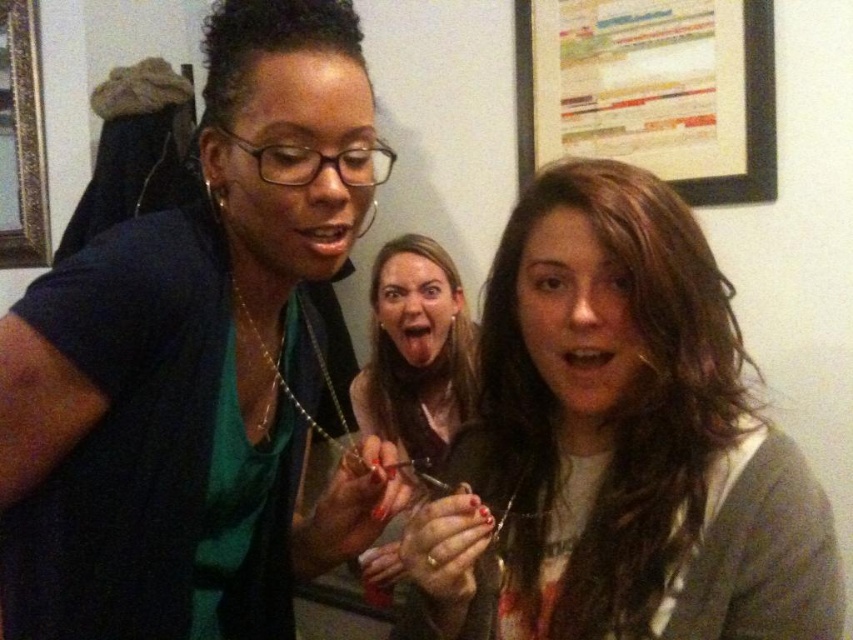
Question: Can you confirm if matte black shirt at center is smaller than white paperboard at upper center?

Choices:
 (A) no
 (B) yes

Answer: (A)

Question: Is matte black shirt at center bigger than matte brown hair at center?

Choices:
 (A) yes
 (B) no

Answer: (A)

Question: Which point is farther to the camera?

Choices:
 (A) white paperboard at upper center
 (B) matte black scissors at center
 (C) matte brown hair at center
 (D) gold ornate picture frame at upper left

Answer: (D)

Question: Which is nearer to the gold ornate picture frame at upper left?

Choices:
 (A) matte black scissors at center
 (B) matte brown hair at center

Answer: (A)

Question: Which point is farther to the camera?

Choices:
 (A) gold ornate picture frame at upper left
 (B) matte black shirt at center
 (C) white paperboard at upper center

Answer: (A)

Question: Observing the image, what is the correct spatial positioning of matte black scissors at center in reference to white paperboard at upper center?

Choices:
 (A) left
 (B) right

Answer: (A)